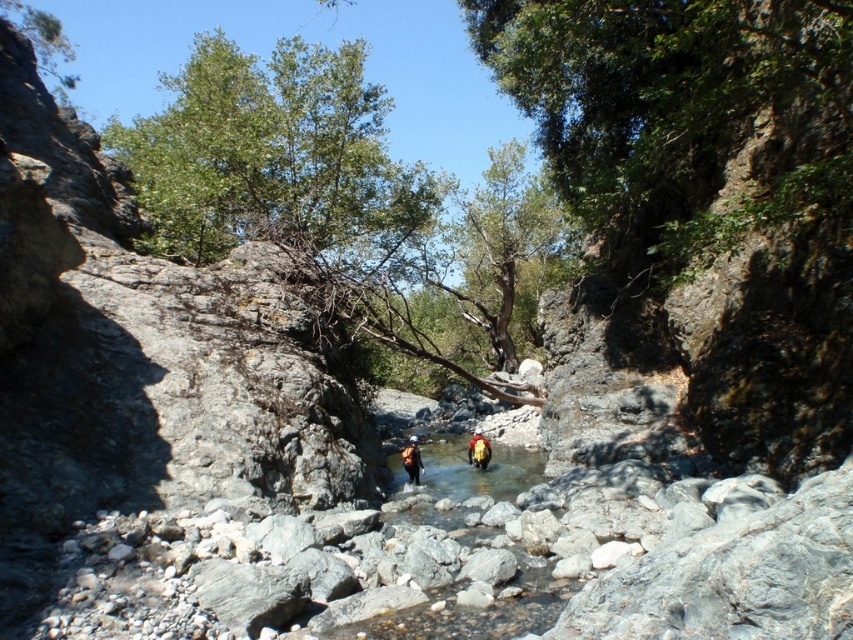
Question: Which of these objects is positioned farthest from the yellow fabric backpack at center?

Choices:
 (A) yellow life jacket at center
 (B) green leafy tree at upper center

Answer: (B)

Question: Based on their relative distances, which object is nearer to the yellow fabric backpack at center?

Choices:
 (A) yellow life jacket at center
 (B) green leafy tree at upper center

Answer: (A)

Question: Does green leafy tree at upper center come behind yellow fabric backpack at center?

Choices:
 (A) yes
 (B) no

Answer: (B)

Question: Considering the real-world distances, which object is closest to the yellow fabric backpack at center?

Choices:
 (A) yellow life jacket at center
 (B) green leafy tree at upper center

Answer: (A)

Question: Can you confirm if green leafy tree at upper center is thinner than yellow life jacket at center?

Choices:
 (A) yes
 (B) no

Answer: (B)

Question: Does green leafy tree at upper center appear over yellow fabric backpack at center?

Choices:
 (A) no
 (B) yes

Answer: (B)